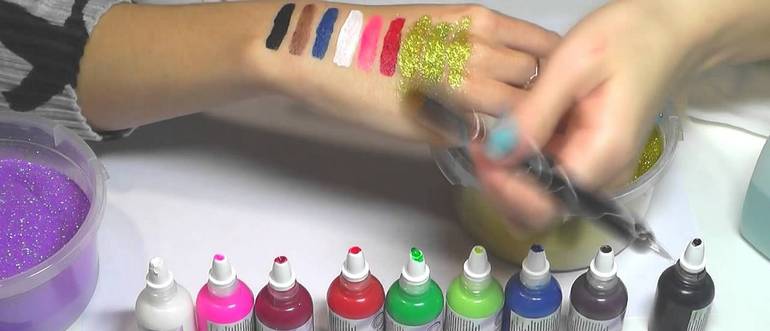
This screenshot has height=331, width=770. Identify the location of white paint. point(156,299), point(346,42).